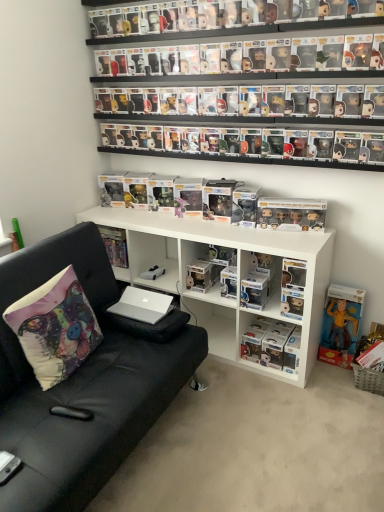
Question: Considering the relative sizes of yellow fabric figurine at lower right, the third book positioned from the left, and clear plastic figure at center, marked as the second book in a right-to-left arrangement, in the image provided, is yellow fabric figurine at lower right, the third book positioned from the left, bigger than clear plastic figure at center, marked as the second book in a right-to-left arrangement,?

Choices:
 (A) yes
 (B) no

Answer: (B)

Question: Does yellow fabric figurine at lower right, which is counted as the first book, starting from the right, have a smaller size compared to clear plastic figure at center, marked as the second book in a right-to-left arrangement?

Choices:
 (A) no
 (B) yes

Answer: (B)

Question: From the image's perspective, is yellow fabric figurine at lower right, the third book positioned from the left, on top of clear plastic figure at center, marked as the second book in a right-to-left arrangement?

Choices:
 (A) yes
 (B) no

Answer: (A)

Question: From a real-world perspective, does yellow fabric figurine at lower right, the third book positioned from the left, sit lower than clear plastic figure at center, the 2th book viewed from the left?

Choices:
 (A) yes
 (B) no

Answer: (B)

Question: Considering the relative sizes of yellow fabric figurine at lower right, the third book positioned from the left, and clear plastic figure at center, marked as the second book in a right-to-left arrangement, in the image provided, is yellow fabric figurine at lower right, the third book positioned from the left, thinner than clear plastic figure at center, marked as the second book in a right-to-left arrangement,?

Choices:
 (A) no
 (B) yes

Answer: (B)

Question: Does point (254, 351) appear closer or farther from the camera than point (321, 212)?

Choices:
 (A) closer
 (B) farther

Answer: (B)

Question: Considering their positions, is clear plastic figure at center, marked as the second book in a right-to-left arrangement, located in front of or behind satin gold figurines at center, which is the second toy from bottom to top?

Choices:
 (A) behind
 (B) front

Answer: (A)

Question: From a real-world perspective, is clear plastic figure at center, the 2th book viewed from the left, above or below satin gold figurines at center, which appears as the second toy when viewed from the front?

Choices:
 (A) above
 (B) below

Answer: (B)

Question: From the image's perspective, relative to satin gold figurines at center, which appears as the second toy when viewed from the front, is clear plastic figure at center, the 2th book viewed from the left, above or below?

Choices:
 (A) below
 (B) above

Answer: (A)

Question: Based on their sizes in the image, would you say black leather couch at left is bigger or smaller than satin gold figurines at center, the third toy from the back?

Choices:
 (A) big
 (B) small

Answer: (A)

Question: Relative to satin gold figurines at center, which appears as the second toy when viewed from the front, is black leather couch at left in front or behind?

Choices:
 (A) front
 (B) behind

Answer: (A)

Question: Is black leather couch at left situated inside satin gold figurines at center, which appears as the second toy when viewed from the front, or outside?

Choices:
 (A) inside
 (B) outside

Answer: (B)

Question: Considering the relative positions of black leather couch at left and satin gold figurines at center, the second toy from the right, in the image provided, is black leather couch at left to the left or to the right of satin gold figurines at center, the second toy from the right,?

Choices:
 (A) right
 (B) left

Answer: (B)

Question: Is black plastic remote control at lower left taller or shorter than satin gold figurines at center, the second toy from the right?

Choices:
 (A) tall
 (B) short

Answer: (B)

Question: Considering the relative positions of black plastic remote control at lower left and satin gold figurines at center, which appears as the second toy when viewed from the front, in the image provided, is black plastic remote control at lower left to the left or to the right of satin gold figurines at center, which appears as the second toy when viewed from the front,?

Choices:
 (A) left
 (B) right

Answer: (A)